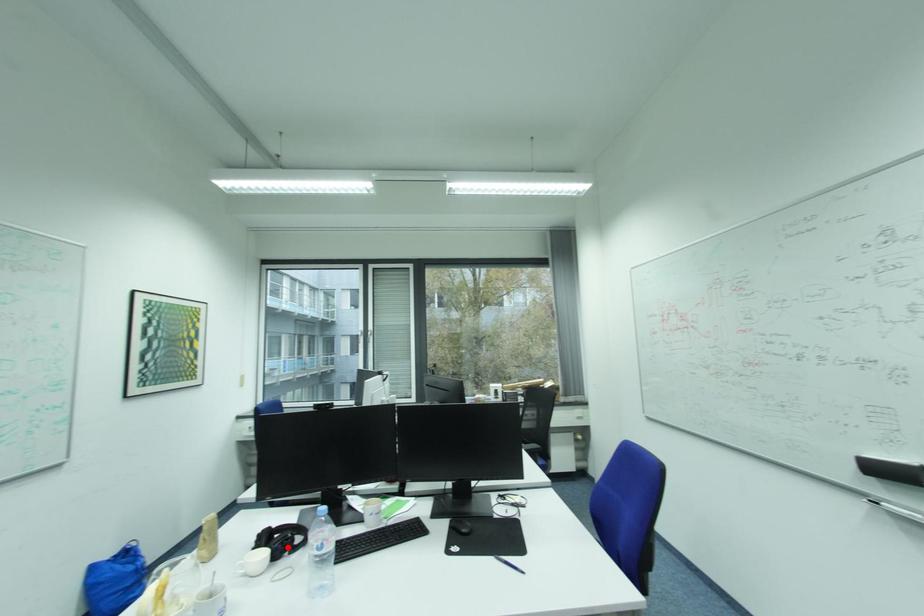
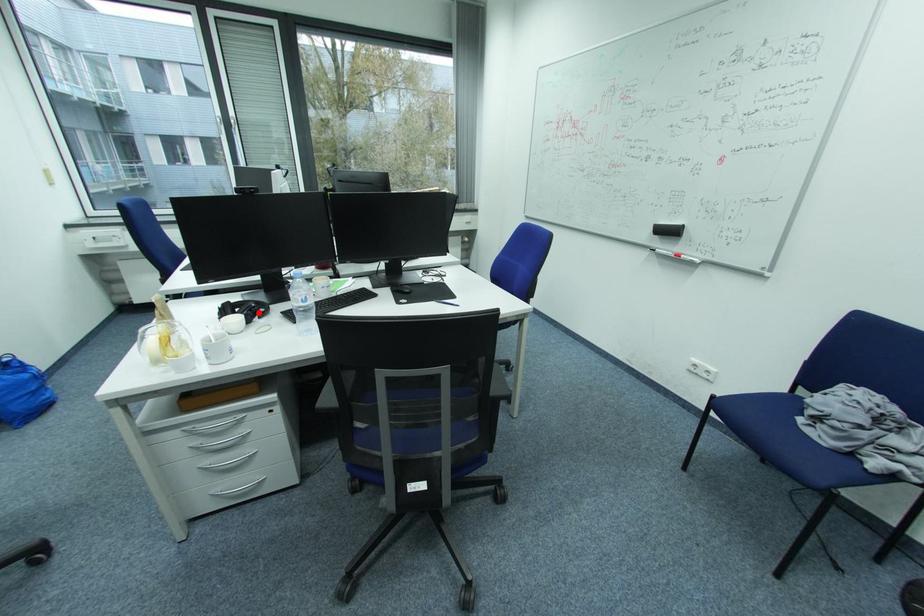
Looking at this image, I am providing you with two images of the same scene from different viewpoints. A red point is marked on the first image and another point is marked on the second image. Is the marked point in image1 the same physical position as the marked point in image2?

Yes